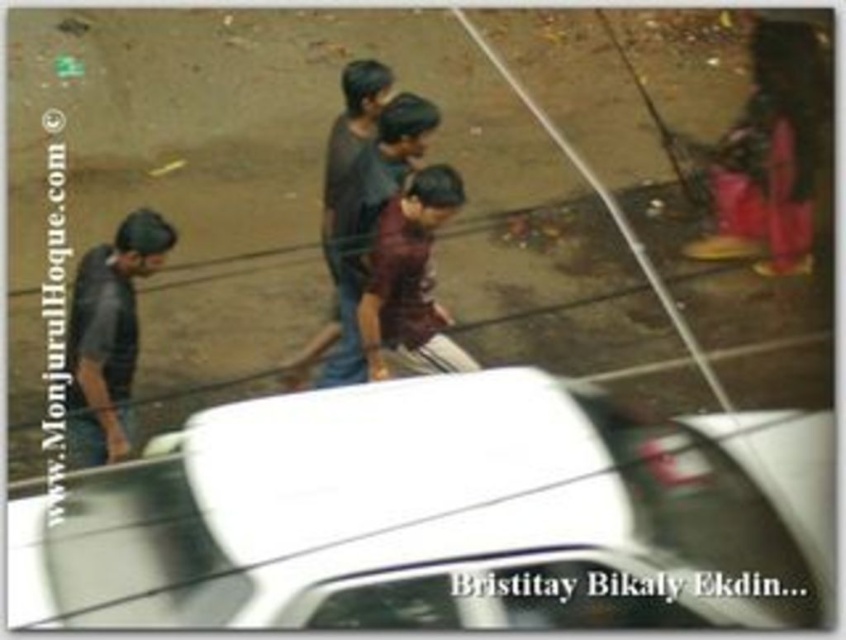
Question: From the image, what is the correct spatial relationship of white glossy car at lower center in relation to dark blue jeans at left?

Choices:
 (A) left
 (B) right

Answer: (B)

Question: Does white glossy car at lower center come in front of dark blue jeans at left?

Choices:
 (A) no
 (B) yes

Answer: (B)

Question: Which object is closer to the camera taking this photo?

Choices:
 (A) dark blue jeans at left
 (B) maroon fabric shirt at center

Answer: (A)

Question: Which of the following is the closest to the observer?

Choices:
 (A) (89, 412)
 (B) (515, 570)

Answer: (B)

Question: Which of the following is the farthest from the observer?

Choices:
 (A) (73, 387)
 (B) (309, 460)
 (C) (380, 227)

Answer: (C)

Question: Can you confirm if white glossy car at lower center is wider than maroon fabric shirt at center?

Choices:
 (A) yes
 (B) no

Answer: (A)